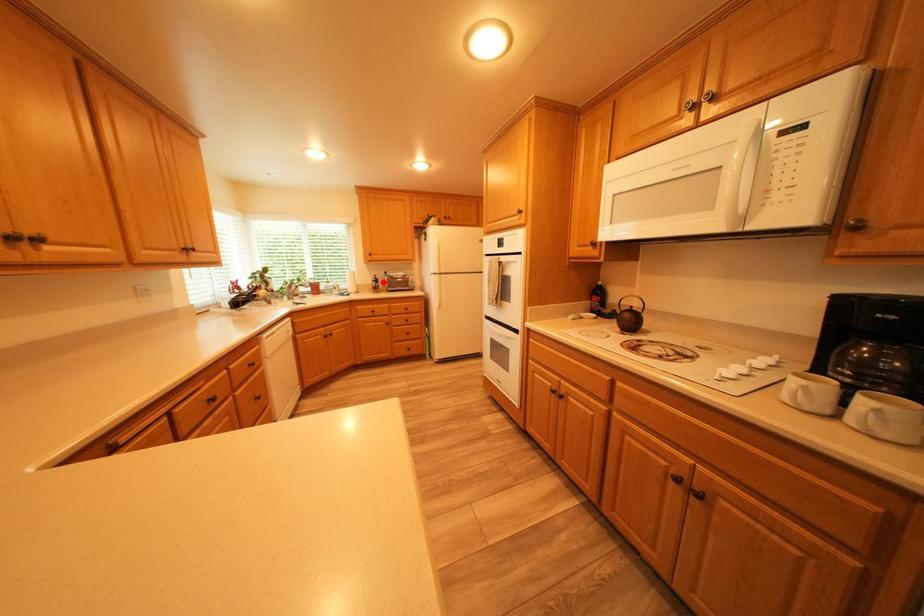
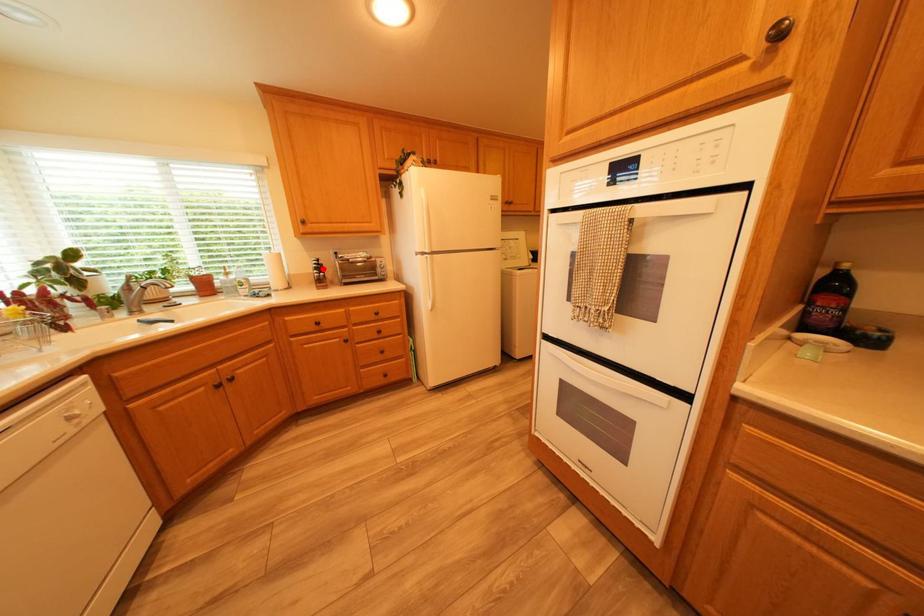
I am providing you with two images of the same scene from different viewpoints. A red point is marked on the first image and another point is marked on the second image. Does the point marked in image1 correspond to the same location as the one in image2?

Yes